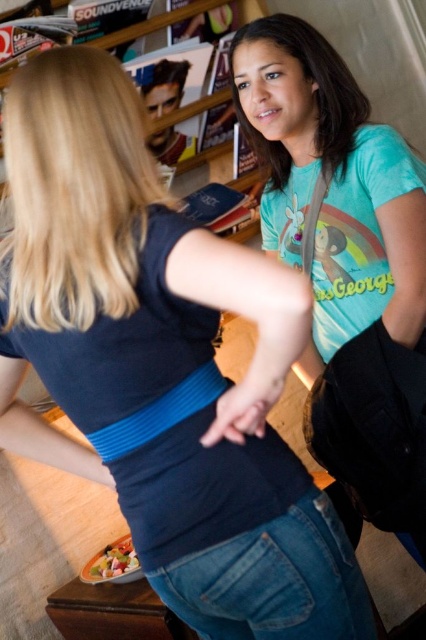
You are a customer in a bookstore and see the wooden bookshelf at upper center and the smooth plastic container at lower left. Which object is positioned to the right of the other?

The wooden bookshelf at upper center is positioned to the right of the smooth plastic container at lower left.